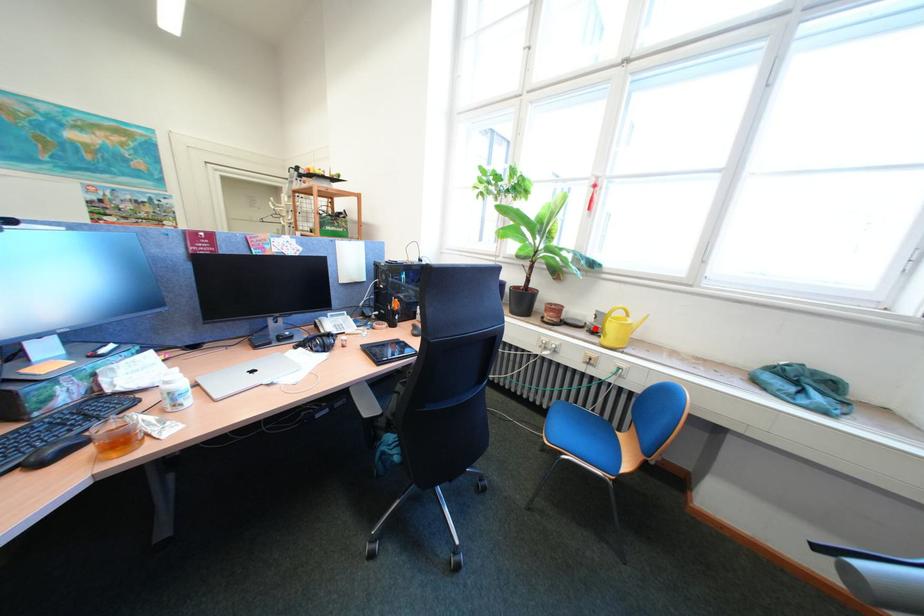
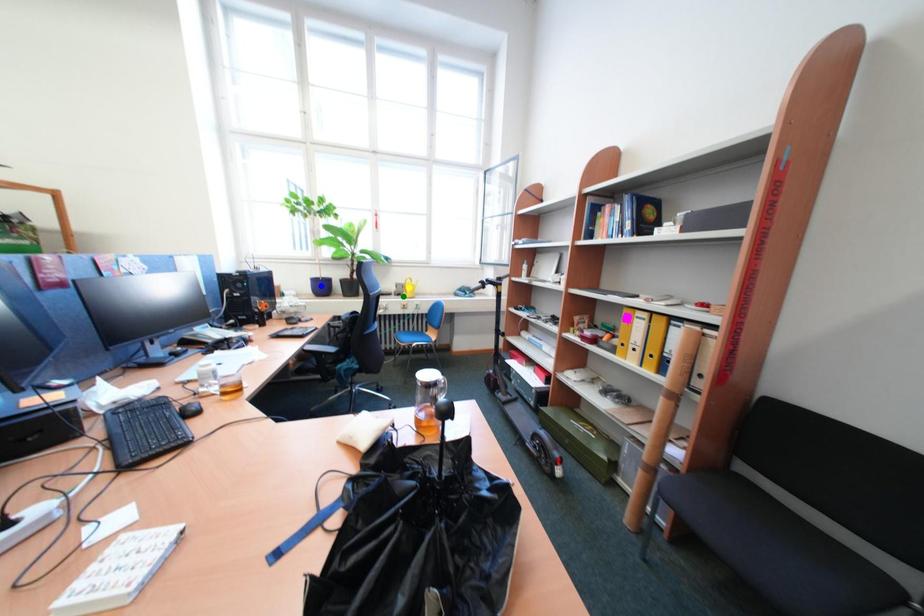
Question: I am providing you with two images of the same scene from different viewpoints. A red point is marked on the first image. You are given multiple points on the second image. Which point in image 2 is actually the same real-world point as the red point in image 1?

Choices:
 (A) blue point
 (B) green point
 (C) yellow point

Answer: (B)